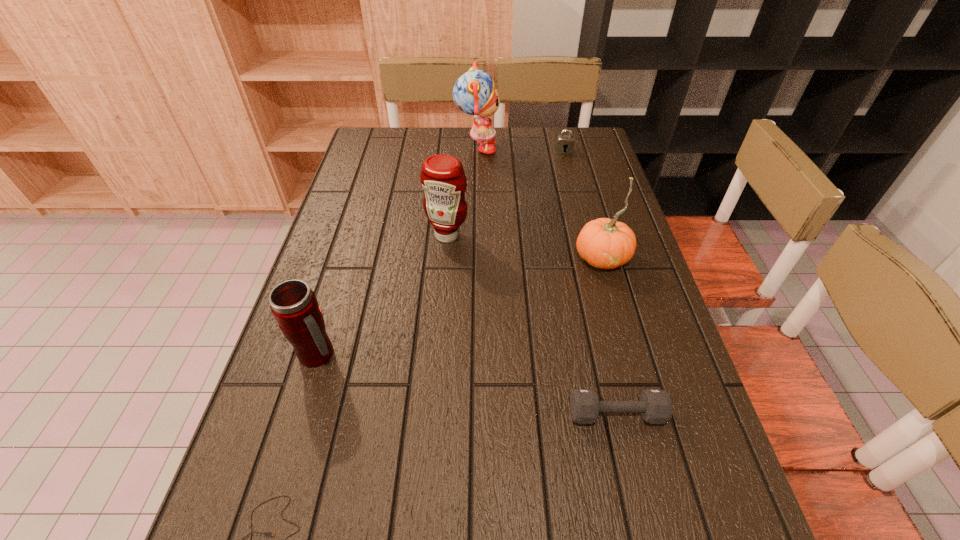
Locate an element on the screen. vacant position at the far edge of the desktop is located at coordinates (427, 151).

This screenshot has height=540, width=960. What are the coordinates of `free space at the left edge of the desktop` in the screenshot? It's located at (318, 279).

This screenshot has width=960, height=540. In the image, there is a desktop. What are the coordinates of `vacant space at the right edge` in the screenshot? It's located at (601, 208).

Find the location of a particular element. vacant area at the far left corner of the desktop is located at coordinates (371, 144).

In the image, there is a desktop. Identify the location of vacant space at the far right corner. Image resolution: width=960 pixels, height=540 pixels. (558, 159).

Where is `vacant space that is in between the condiment and the third shortest object`? vacant space that is in between the condiment and the third shortest object is located at coordinates (506, 193).

The width and height of the screenshot is (960, 540). Find the location of `empty location between the third nearest object and the condiment`. empty location between the third nearest object and the condiment is located at coordinates coord(383,295).

At what (x,y) coordinates should I click in order to perform the action: click on unoccupied area between the padlock and the condiment. Please return your answer as a coordinate pair (x, y). Looking at the image, I should click on (506, 193).

You are a GUI agent. You are given a task and a screenshot of the screen. Output one action in this format:
    pyautogui.click(x=<x>, y=<y>)
    Task: Click on the blank region between the dumbbell and the pumpkin
    The width and height of the screenshot is (960, 540).
    Given the screenshot: What is the action you would take?
    pyautogui.click(x=609, y=336)

Identify the location of vacant area that lies between the padlock and the second nearest object. The height and width of the screenshot is (540, 960). (590, 282).